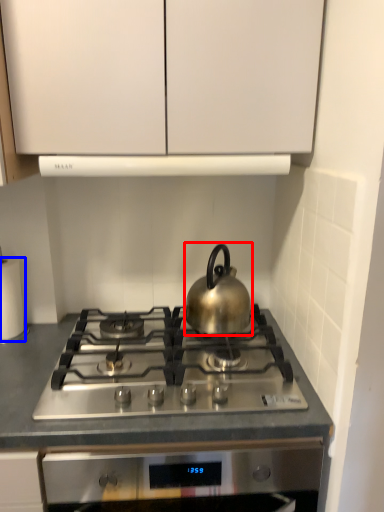
Question: Which object appears closest to the camera in this image, kettle (highlighted by a red box) or paper towel (highlighted by a blue box)?

Choices:
 (A) kettle
 (B) paper towel

Answer: (A)